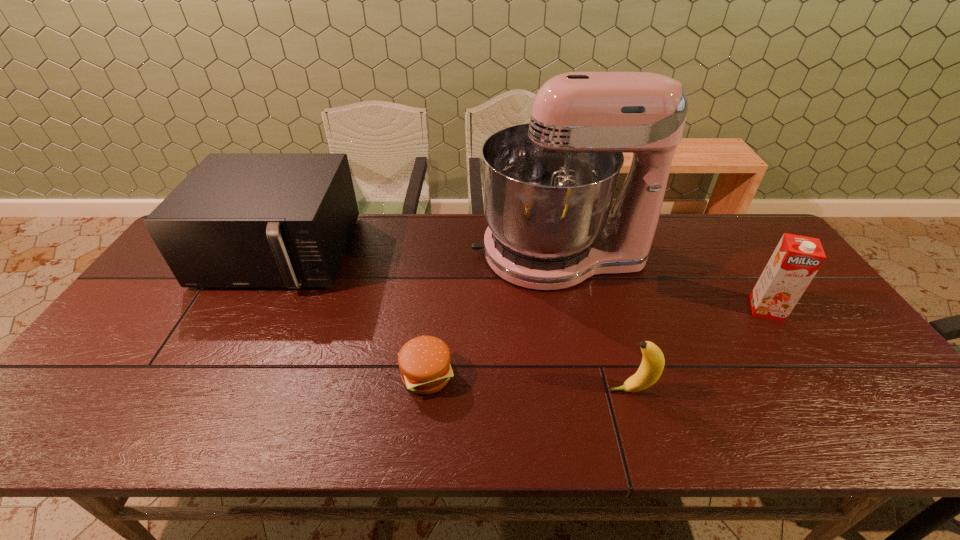
Where is `vacant region located on the right of the rightmost object`? The width and height of the screenshot is (960, 540). vacant region located on the right of the rightmost object is located at coordinates (817, 309).

Image resolution: width=960 pixels, height=540 pixels. I want to click on vacant space positioned 0.330m from the stem of the second shortest object, so click(x=467, y=390).

Identify the location of vacant space located from the stem of the second shortest object. The height and width of the screenshot is (540, 960). tap(540, 390).

In order to click on vacant space located 0.240m from the stem of the second shortest object in this screenshot , I will do `click(506, 390)`.

At what (x,y) coordinates should I click in order to perform the action: click on free location located 0.130m on the right of the hamburger. Please return your answer as a coordinate pair (x, y). The width and height of the screenshot is (960, 540). Looking at the image, I should click on (510, 375).

The width and height of the screenshot is (960, 540). What are the coordinates of `mixer that is at the far edge` in the screenshot? It's located at (548, 186).

This screenshot has height=540, width=960. Identify the location of microwave oven located in the far edge section of the desktop. (239, 220).

This screenshot has width=960, height=540. I want to click on object present at the left edge, so click(x=239, y=220).

In order to click on object that is at the right edge in this screenshot , I will do `click(796, 260)`.

Where is `object present at the far left corner`? This screenshot has width=960, height=540. object present at the far left corner is located at coordinates (239, 220).